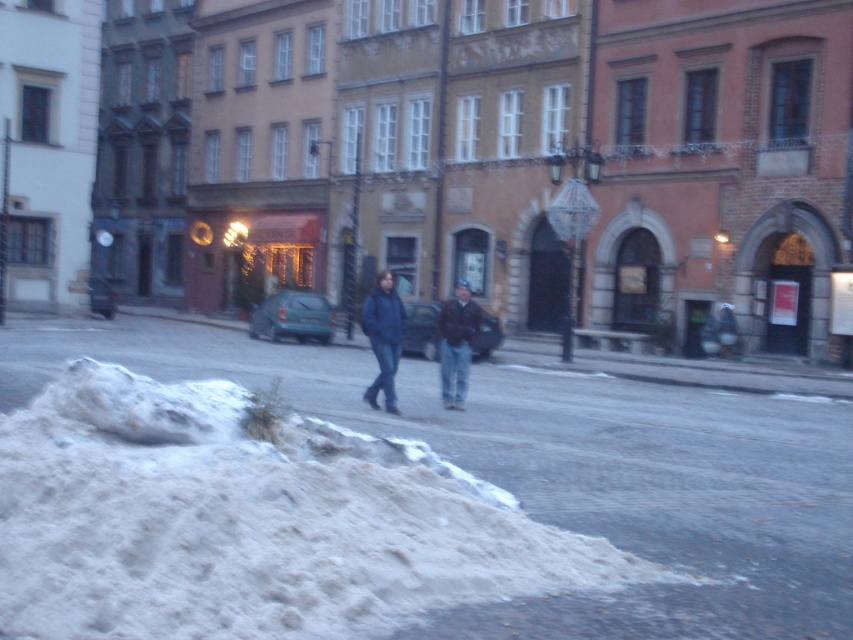
You are a delivery person trying to navigate through the snowy street. You see the white powdery snow at lower left and the dark brown leather jacket at center. Which object is larger in size?

The white powdery snow at lower left is smaller than the dark brown leather jacket at center, so the dark brown leather jacket at center is larger in size.

You are a delivery person trying to navigate through the snowy street. You see the white powdery snow at lower left and the matte blue jacket at center. Which object is positioned further to the right in the scene?

The white powdery snow at lower left is to the right of the matte blue jacket at center, so the white powdery snow at lower left is positioned further to the right in the scene.

Looking at this image, you are standing at the edge of the snow pile in the foreground and want to reach the matte blue jacket at center. The snow pile is 10 feet wide. Can you walk straight ahead without stepping into the snow?

The matte blue jacket at center is 48.27 feet away from you. Since the snow pile is only 10 feet wide, you can walk straight ahead and avoid the snow by stepping onto the street after the snow pile, which is 10 feet wide, leaving 38.27 feet of clear path to the jacket.